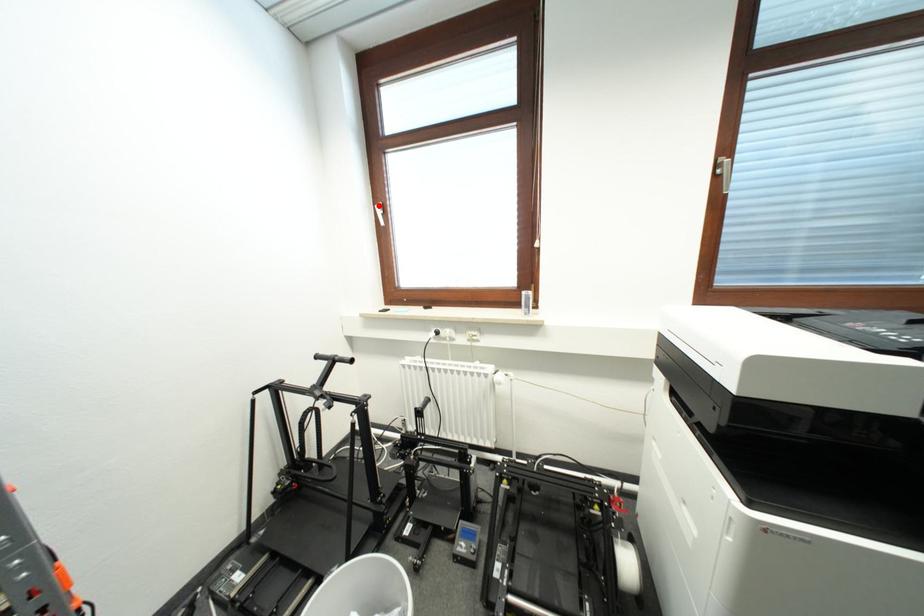
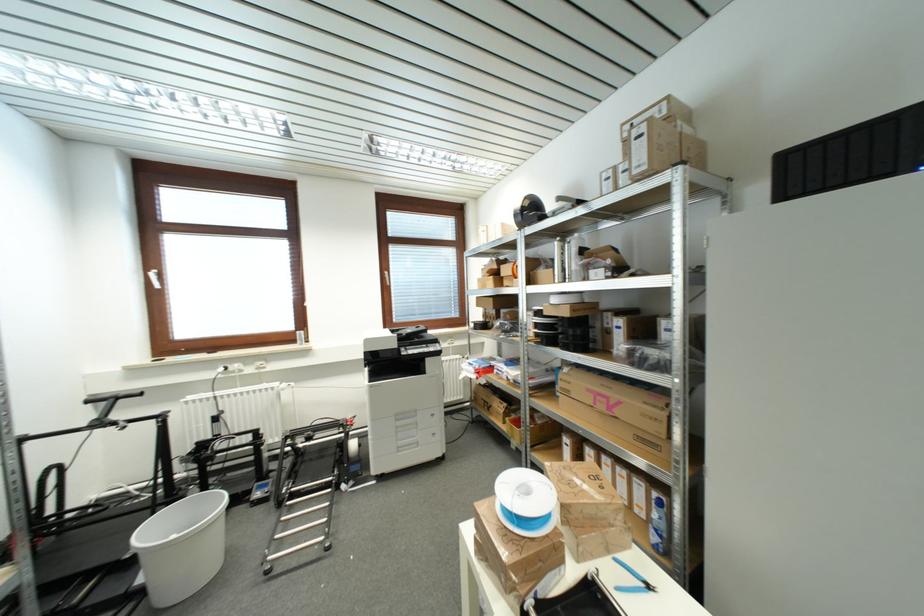
Find the pixel in the second image that matches the highlighted location in the first image.

(151, 273)